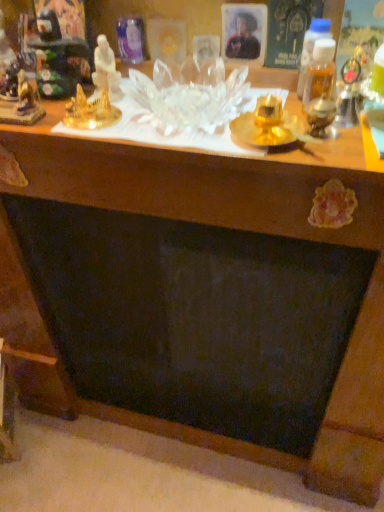
Question: Looking at their shapes, would you say gold metallic statue at upper left, acting as the 2th toy starting from the right, is wider or thinner than transparent glass table at upper center?

Choices:
 (A) thin
 (B) wide

Answer: (A)

Question: Is gold metallic statue at upper left, acting as the 2th toy starting from the right, taller or shorter than transparent glass table at upper center?

Choices:
 (A) short
 (B) tall

Answer: (B)

Question: Based on their relative distances, which object is farther from the gold metallic statue at upper left, placed as the fourth toy when sorted from right to left?

Choices:
 (A) matte black portrait at upper center
 (B) gold metallic statue at upper left, acting as the 2th toy starting from the right
 (C) transparent glass table at upper center
 (D) white porcelain statue at upper left, placed as the 4th toy when sorted from left to right
 (E) metallic gold figurine at upper left, which is the second toy in left-to-right order

Answer: (A)

Question: Estimate the real-world distances between objects in this image. Which object is farther from the gold metallic statue at upper left, the 1th toy positioned from the left?

Choices:
 (A) transparent glass table at upper center
 (B) gold metallic statue at upper left, the 3th toy in the left-to-right sequence
 (C) matte black portrait at upper center
 (D) white porcelain statue at upper left, placed as the 4th toy when sorted from left to right
 (E) metallic gold figurine at upper left, the 3th toy from the right

Answer: (C)